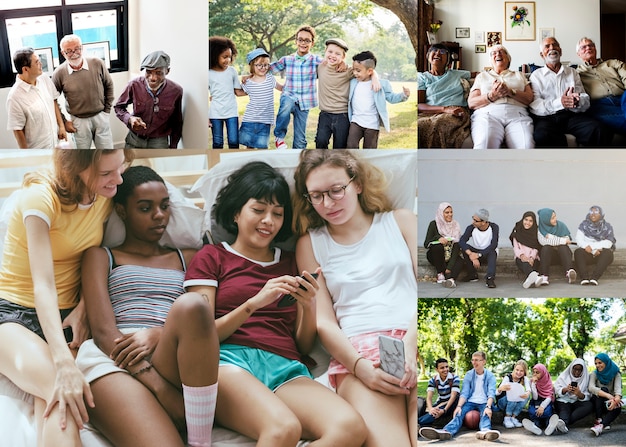
Identify the location of framed artwork on walls. The image size is (626, 447). (99, 45), (48, 58), (104, 21), (36, 29), (462, 31), (431, 33), (478, 47), (493, 35), (526, 11), (545, 29).